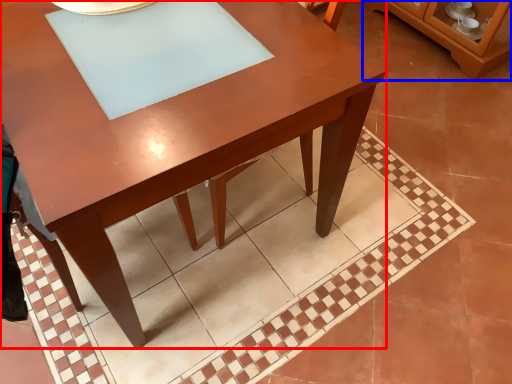
Question: Among these objects, which one is nearest to the camera, table (highlighted by a red box) or dresser (highlighted by a blue box)?

Choices:
 (A) table
 (B) dresser

Answer: (A)